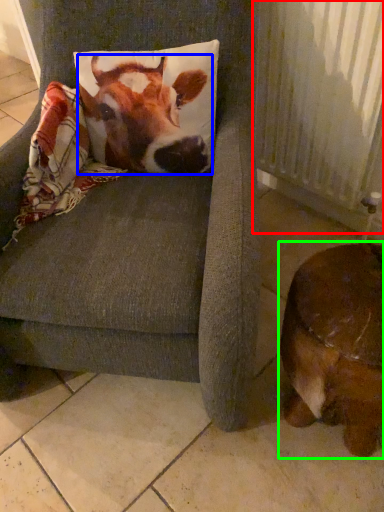
Question: Considering the real-world distances, which object is closest to radiator (highlighted by a red box)? cattle (highlighted by a blue box) or dog (highlighted by a green box).

Choices:
 (A) cattle
 (B) dog

Answer: (A)